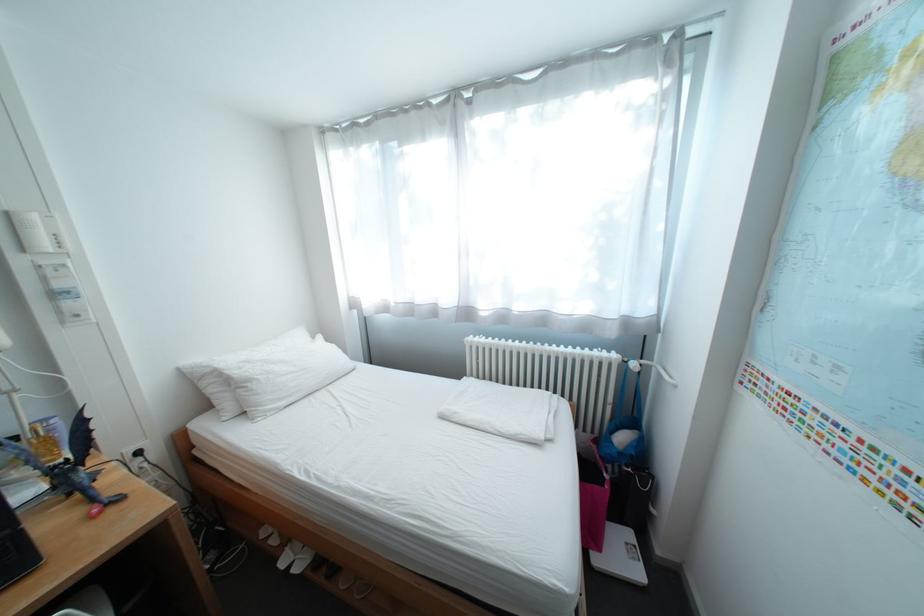
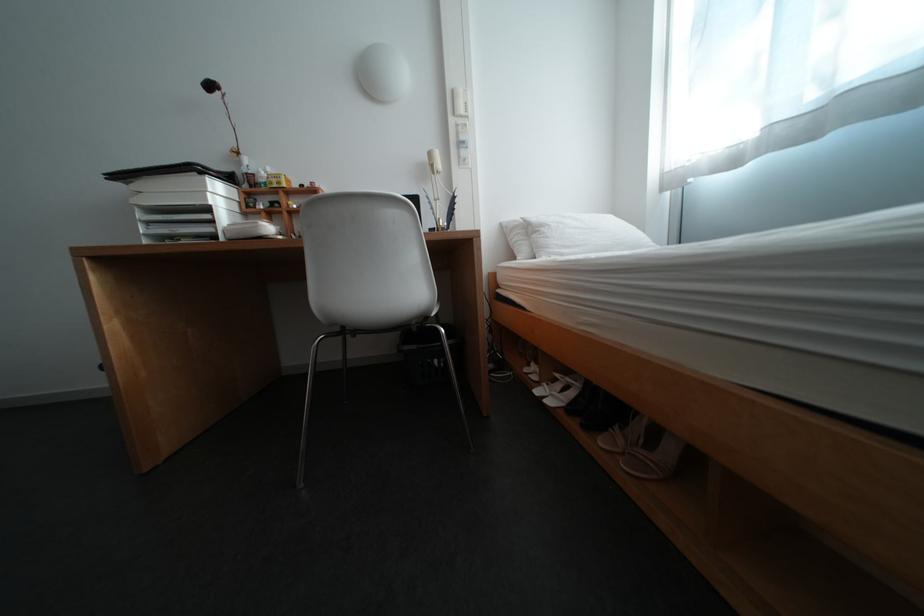
Find the pixel in the second image that matches the point at 263,383 in the first image.

(555, 228)